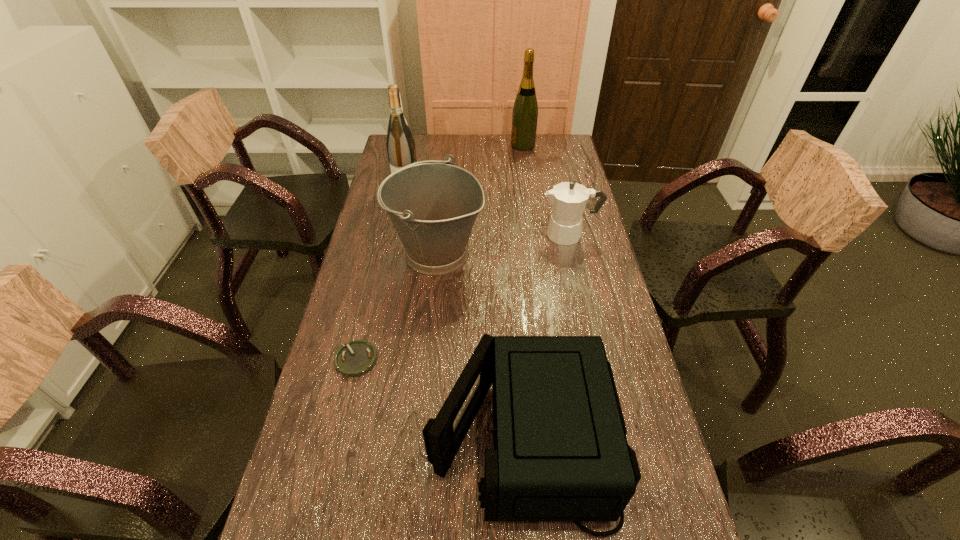
You are a GUI agent. You are given a task and a screenshot of the screen. Output one action in this format:
    pyautogui.click(x=<x>, y=<y>)
    Task: Click on the farther wine bottle
    This screenshot has height=540, width=960.
    Given the screenshot: What is the action you would take?
    pyautogui.click(x=525, y=109)

Locate an element on the screen. The image size is (960, 540). the right wine bottle is located at coordinates (x=525, y=109).

At what (x,y) coordinates should I click in order to perform the action: click on the left wine bottle. Please return your answer as a coordinate pair (x, y). This screenshot has width=960, height=540. Looking at the image, I should click on (400, 144).

Locate an element on the screen. The image size is (960, 540). the nearer wine bottle is located at coordinates (400, 144).

What are the coordinates of `the fourth shortest object` in the screenshot? It's located at click(433, 204).

Find the location of `coffeepot`. coffeepot is located at coordinates (568, 199).

Locate an element on the screen. This screenshot has width=960, height=540. microwave oven is located at coordinates (560, 454).

At what (x,y) coordinates should I click in order to perform the action: click on ashtray. Please return your answer as a coordinate pair (x, y). The height and width of the screenshot is (540, 960). Looking at the image, I should click on (354, 359).

Locate an element on the screen. This screenshot has height=540, width=960. vacant space located on the front-facing side of the farthest object is located at coordinates (499, 145).

Locate an element on the screen. vacant area located on the front-facing side of the farthest object is located at coordinates 458,145.